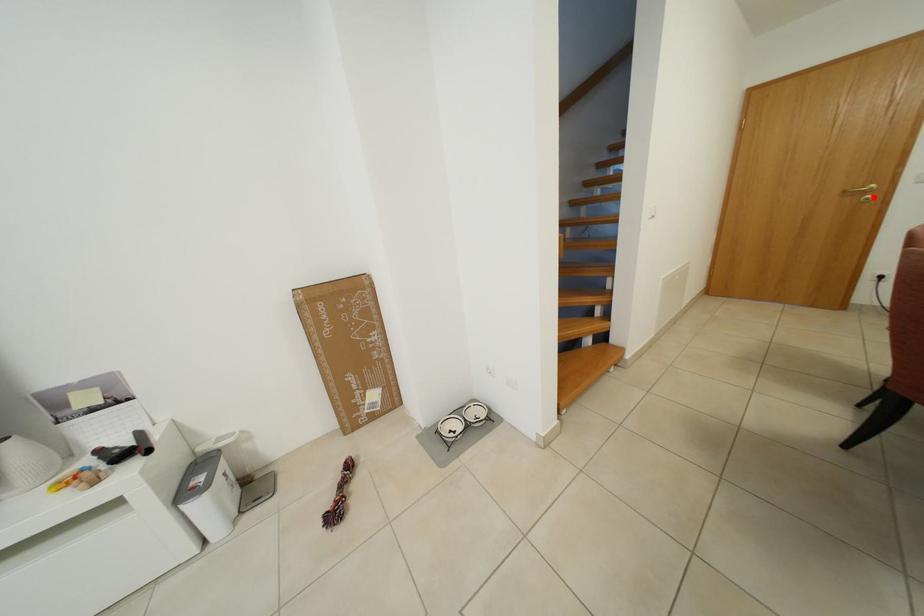
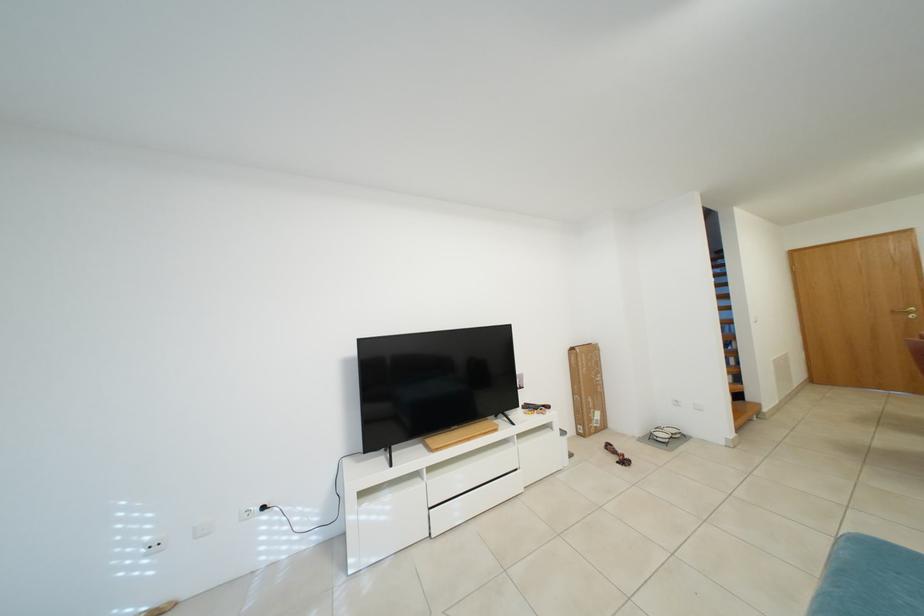
Find the pixel in the second image that matches the highlighted location in the first image.

(918, 317)